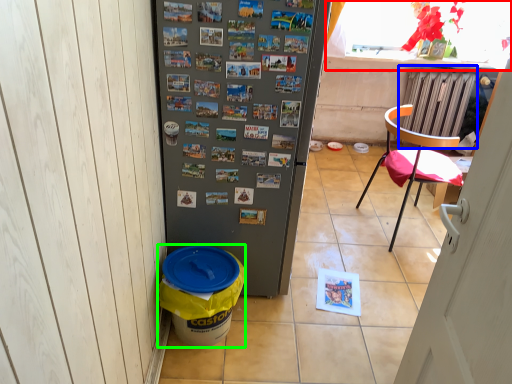
Question: Which object is positioned closest to window screen (highlighted by a red box)? Select from radiator (highlighted by a blue box) and recycling bin (highlighted by a green box).

Choices:
 (A) radiator
 (B) recycling bin

Answer: (A)